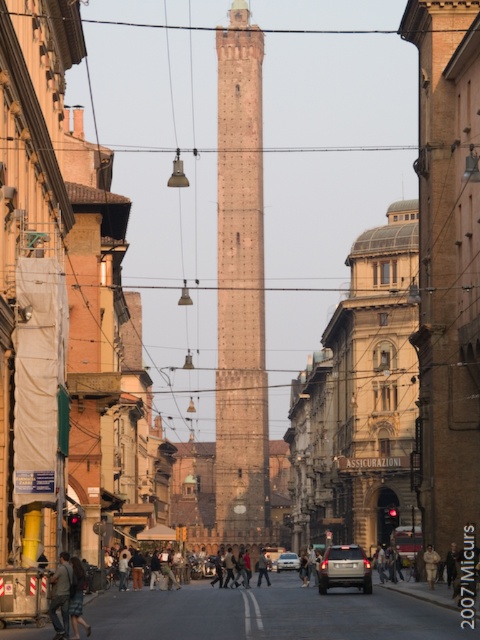
Question: Does denim jacket at lower left have a lesser width compared to light beige fabric coat at center?

Choices:
 (A) no
 (B) yes

Answer: (A)

Question: Considering the real-world distances, which object is closest to the brown stone tower at center?

Choices:
 (A) silver metallic car at center
 (B) satin silver sedan at center
 (C) dark brown leather jacket at center
 (D) light beige fabric coat at center

Answer: (C)

Question: Which of the following is the farthest from the observer?

Choices:
 (A) brown stone tower at center
 (B) denim jacket at lower left
 (C) dark brown leather jacket at center

Answer: (A)

Question: Among these points, which one is nearest to the camera?

Choices:
 (A) (257, 582)
 (B) (430, 570)
 (C) (296, 557)
 (D) (51, 614)

Answer: (D)

Question: Can you confirm if brown stone tower at center is wider than denim jacket at lower left?

Choices:
 (A) no
 (B) yes

Answer: (B)

Question: Is brown stone tower at center positioned at the back of denim jacket at lower left?

Choices:
 (A) no
 (B) yes

Answer: (B)